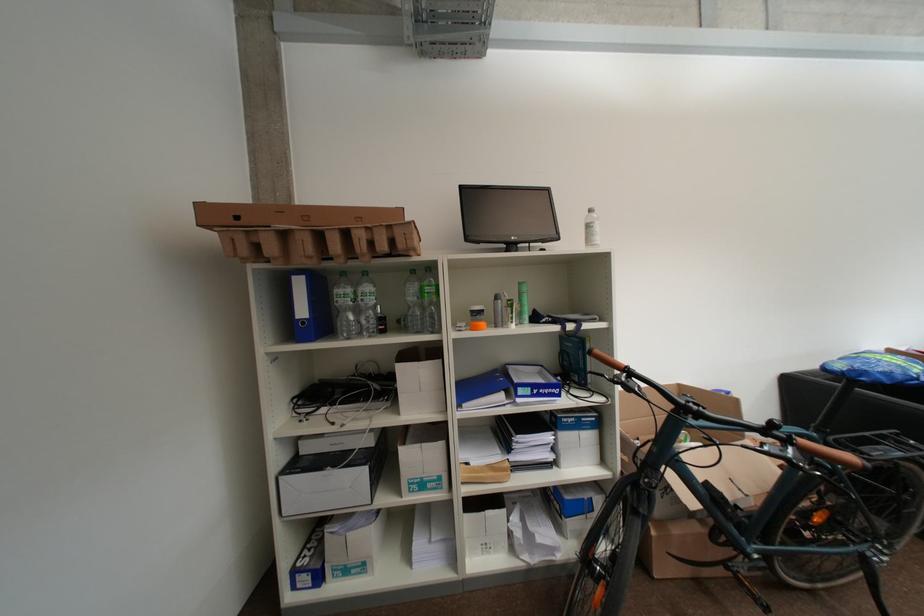
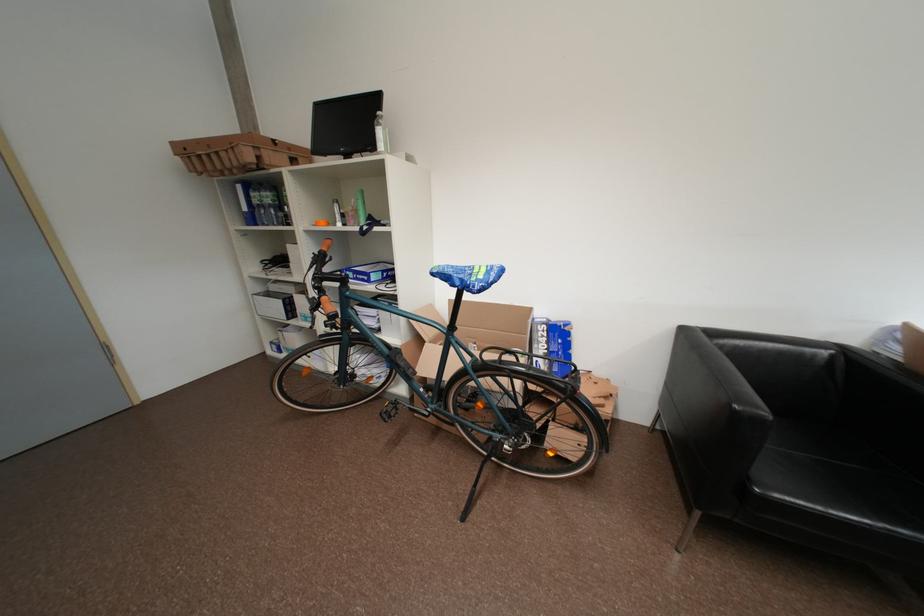
Find the pixel in the second image that matches [605,241] in the first image.

(388, 148)